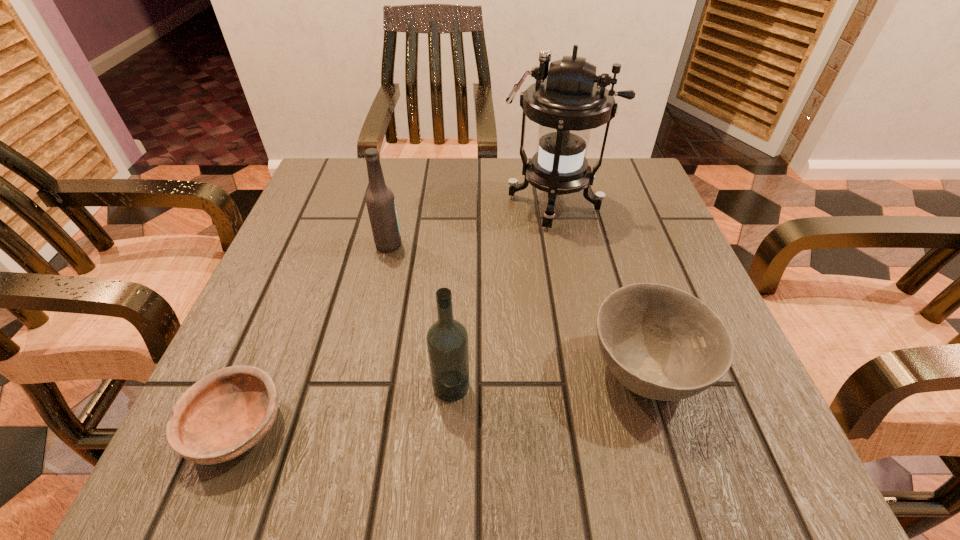
At what (x,y) coordinates should I click in order to perform the action: click on vacant area that lies between the fourth nearest object and the lantern. Please return your answer as a coordinate pair (x, y). This screenshot has height=540, width=960. Looking at the image, I should click on (470, 224).

Find the location of `vacant area between the second shortest object and the shortest object`. vacant area between the second shortest object and the shortest object is located at coordinates (441, 400).

Where is `free space between the beer bottle and the tallest object`? free space between the beer bottle and the tallest object is located at coordinates (470, 224).

You are a GUI agent. You are given a task and a screenshot of the screen. Output one action in this format:
    pyautogui.click(x=<x>, y=<y>)
    Task: Click on the vacant point located between the fourth nearest object and the third object from right to left
    
    Given the screenshot: What is the action you would take?
    (420, 315)

Locate an element on the screen. This screenshot has height=540, width=960. unoccupied position between the fourth object from right to left and the third object from left to right is located at coordinates (420, 315).

Where is `vacant region between the second object from left to right and the vodka`? Image resolution: width=960 pixels, height=540 pixels. vacant region between the second object from left to right and the vodka is located at coordinates (420, 315).

The height and width of the screenshot is (540, 960). Identify the location of vacant area between the shorter bowl and the tallest object. (396, 315).

The height and width of the screenshot is (540, 960). I want to click on object that stands as the fourth closest to the shortest object, so click(569, 100).

Locate an element on the screen. The image size is (960, 540). object that ranks as the second closest to the second shortest object is located at coordinates (569, 100).

This screenshot has width=960, height=540. I want to click on free space in the image that satisfies the following two spatial constraints: 1. on the back side of the vodka; 2. on the label of the beer bottle, so click(459, 245).